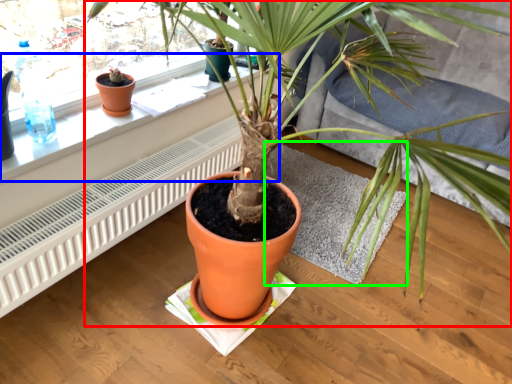
Question: Which is farther away from houseplant (highlighted by a red box)? window sill (highlighted by a blue box) or wide (highlighted by a green box)?

Choices:
 (A) window sill
 (B) wide

Answer: (B)